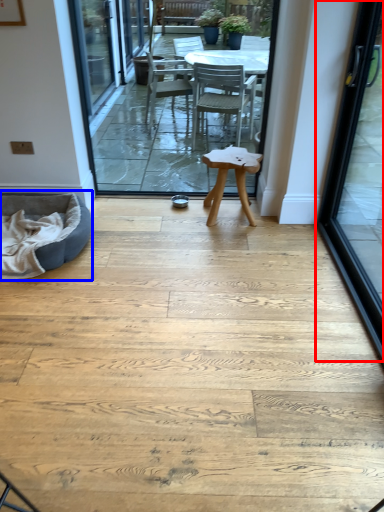
Question: Which object appears closest to the camera in this image, door (highlighted by a red box) or bean bag chair (highlighted by a blue box)?

Choices:
 (A) door
 (B) bean bag chair

Answer: (A)